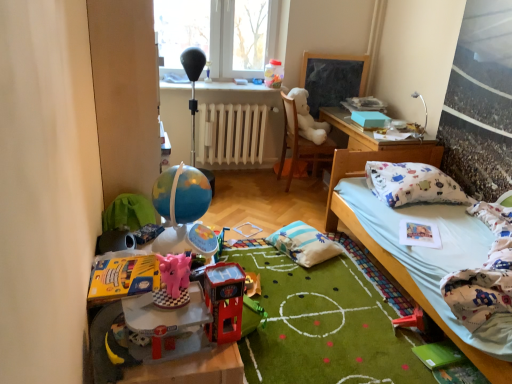
Question: From the image's perspective, is white matte radiator at center above or below shiny plastic toy car at center, the third toy in the back-to-front sequence?

Choices:
 (A) below
 (B) above

Answer: (B)

Question: Considering the positions of white matte radiator at center and shiny plastic toy car at center, which ranks as the 3th toy in bottom-to-top order, in the image, is white matte radiator at center bigger or smaller than shiny plastic toy car at center, which ranks as the 3th toy in bottom-to-top order,?

Choices:
 (A) small
 (B) big

Answer: (B)

Question: Which is farther from the pink plastic piggy bank at lower left, the first toy in the left-to-right sequence?

Choices:
 (A) translucent plastic container at upper center, the first toy from the back
 (B) shiny plastic toy car at center, which is counted as the third toy, starting from the top
 (C) white matte radiator at center
 (D) rubber red toy at lower right, which appears as the 1th toy when ordered from the bottom
 (E) light blue fabric bed at lower right

Answer: (A)

Question: Which object is positioned farthest from the pink plastic piggy bank at center, which is the second toy from top to bottom?

Choices:
 (A) pink plastic piggy bank at lower left, acting as the second toy starting from the bottom
 (B) transparent plastic window at upper center
 (C) shiny plastic toy car at center, which is counted as the third toy, starting from the top
 (D) white matte radiator at center
 (E) translucent plastic container at upper center, the first toy from the back

Answer: (E)